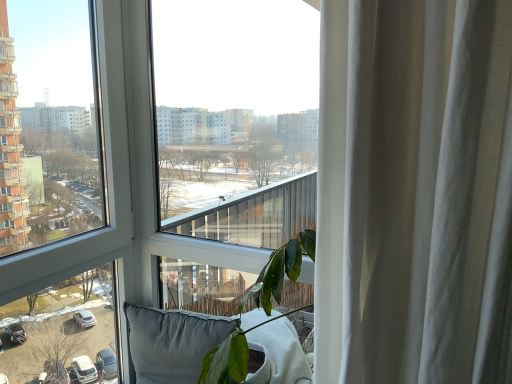
This screenshot has height=384, width=512. Describe the element at coordinates (172, 342) in the screenshot. I see `gray fabric pillow at lower center` at that location.

Locate an element on the screen. This screenshot has width=512, height=384. transparent glass window at center, the first window when ordered from left to right is located at coordinates (48, 126).

What is the approximate width of transparent glass window at center, which is the second window from left to right?

transparent glass window at center, which is the second window from left to right, is 9.62 centimeters wide.

You are a GUI agent. You are given a task and a screenshot of the screen. Output one action in this format:
    pyautogui.click(x=<x>, y=<y>)
    Task: Click on the gray fabric pillow at lower center
    
    Given the screenshot: What is the action you would take?
    pyautogui.click(x=172, y=342)

From the picture: Who is bigger, transparent glass window at center, the first window when ordered from left to right, or gray fabric pillow at lower center?

transparent glass window at center, the first window when ordered from left to right.

Considering the sizes of objects transparent glass window at center, which is the second window in right-to-left order, and gray fabric pillow at lower center in the image provided, who is taller, transparent glass window at center, which is the second window in right-to-left order, or gray fabric pillow at lower center?

transparent glass window at center, which is the second window in right-to-left order, is taller.

From a real-world perspective, who is located lower, transparent glass window at center, the first window when ordered from left to right, or gray fabric pillow at lower center?

In real-world perspective, gray fabric pillow at lower center is lower.

Looking at this image, which is more distant, (33, 163) or (197, 358)?

The point (33, 163) is more distant.

From the image's perspective, between transparent glass window at center, the first window when ordered from left to right, and transparent glass window at center, positioned as the first window in right-to-left order, which one is located above?

transparent glass window at center, positioned as the first window in right-to-left order, from the image's perspective.

Which is closer, [69,79] or [276,379]?

Point [69,79] appears to be farther away from the viewer than point [276,379].

Is the surface of transparent glass window at center, which is the second window in right-to-left order, in direct contact with transparent glass window at center, positioned as the first window in right-to-left order?

No, transparent glass window at center, which is the second window in right-to-left order, is not making contact with transparent glass window at center, positioned as the first window in right-to-left order.

This screenshot has height=384, width=512. Identify the location of window on the left of the transparent glass window at center, which is the second window from left to right. (48, 126).

What are the coordinates of `pillow on the left of transparent glass window at center, which is the second window from left to right` in the screenshot? It's located at tap(172, 342).

Is transparent glass window at center, positioned as the first window in right-to-left order, completely or partially inside gray fabric pillow at lower center?

No, transparent glass window at center, positioned as the first window in right-to-left order, is not surrounded by gray fabric pillow at lower center.

Considering the sizes of objects gray fabric pillow at lower center and transparent glass window at center, which is the second window from left to right, in the image provided, who is thinner, gray fabric pillow at lower center or transparent glass window at center, which is the second window from left to right,?

transparent glass window at center, which is the second window from left to right.

Between point (165, 343) and point (8, 34), which one is positioned in front?

Point (165, 343)

Is point (159, 334) more distant than point (51, 118)?

No, it is in front of (51, 118).

This screenshot has width=512, height=384. Identify the location of pillow on the right side of transparent glass window at center, which is the second window in right-to-left order. (172, 342).

Is gray fabric pillow at lower center looking in the opposite direction of transparent glass window at center, the first window when ordered from left to right?

gray fabric pillow at lower center is not turned away from transparent glass window at center, the first window when ordered from left to right.

From a real-world perspective, is transparent glass window at center, which is the second window from left to right, physically above transparent glass window at center, the first window when ordered from left to right?

Correct, in the physical world, transparent glass window at center, which is the second window from left to right, is higher than transparent glass window at center, the first window when ordered from left to right.

From the image's perspective, does transparent glass window at center, positioned as the first window in right-to-left order, appear higher than transparent glass window at center, the first window when ordered from left to right?

Yes, from the image's perspective, transparent glass window at center, positioned as the first window in right-to-left order, is above transparent glass window at center, the first window when ordered from left to right.

I want to click on window that appears below the transparent glass window at center, which is the second window from left to right (from a real-world perspective), so click(x=48, y=126).

Measure the distance from transparent glass window at center, positioned as the first window in right-to-left order, to gray fabric pillow at lower center.

transparent glass window at center, positioned as the first window in right-to-left order, and gray fabric pillow at lower center are 23.91 inches apart.

Is transparent glass window at center, positioned as the first window in right-to-left order, surrounding gray fabric pillow at lower center?

That's incorrect, gray fabric pillow at lower center is not inside transparent glass window at center, positioned as the first window in right-to-left order.

From a real-world perspective, is transparent glass window at center, positioned as the first window in right-to-left order, over gray fabric pillow at lower center?

Yes, from a real-world perspective, transparent glass window at center, positioned as the first window in right-to-left order, is above gray fabric pillow at lower center.

Is transparent glass window at center, which is the second window from left to right, positioned with its back to gray fabric pillow at lower center?

That's right, transparent glass window at center, which is the second window from left to right, is facing away from gray fabric pillow at lower center.

Identify the location of window on the left side of gray fabric pillow at lower center. The width and height of the screenshot is (512, 384). point(48,126).

Identify the location of window above the transparent glass window at center, which is the second window in right-to-left order (from a real-world perspective). The image size is (512, 384). pyautogui.click(x=233, y=145).

Estimate the real-world distances between objects in this image. Which object is further from transparent glass window at center, which is the second window in right-to-left order, transparent glass window at center, positioned as the first window in right-to-left order, or gray fabric pillow at lower center?

gray fabric pillow at lower center lies further to transparent glass window at center, which is the second window in right-to-left order, than the other object.

Estimate the real-world distances between objects in this image. Which object is closer to transparent glass window at center, positioned as the first window in right-to-left order, gray fabric pillow at lower center or transparent glass window at center, the first window when ordered from left to right?

transparent glass window at center, the first window when ordered from left to right, lies closer to transparent glass window at center, positioned as the first window in right-to-left order, than the other object.

Looking at the image, which one is located further to transparent glass window at center, which is the second window from left to right, transparent glass window at center, which is the second window in right-to-left order, or gray fabric pillow at lower center?

Based on the image, gray fabric pillow at lower center appears to be further to transparent glass window at center, which is the second window from left to right.

When comparing their distances from transparent glass window at center, which is the second window in right-to-left order, does gray fabric pillow at lower center or transparent glass window at center, which is the second window from left to right, seem closer?

The object closer to transparent glass window at center, which is the second window in right-to-left order, is transparent glass window at center, which is the second window from left to right.

Consider the image. Based on their spatial positions, is transparent glass window at center, which is the second window in right-to-left order, or transparent glass window at center, which is the second window from left to right, closer to gray fabric pillow at lower center?

transparent glass window at center, which is the second window in right-to-left order, lies closer to gray fabric pillow at lower center than the other object.

When comparing their distances from gray fabric pillow at lower center, does transparent glass window at center, which is the second window from left to right, or transparent glass window at center, the first window when ordered from left to right, seem closer?

Based on the image, transparent glass window at center, the first window when ordered from left to right, appears to be nearer to gray fabric pillow at lower center.

Locate an element on the screen. The image size is (512, 384). window between transparent glass window at center, which is the second window from left to right, and gray fabric pillow at lower center from top to bottom is located at coordinates (48, 126).